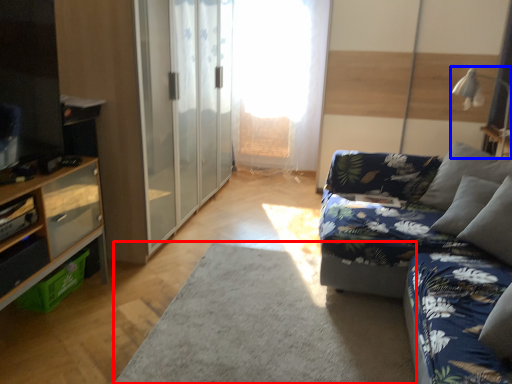
Question: Among these objects, which one is farthest to the camera, plain (highlighted by a red box) or lamp (highlighted by a blue box)?

Choices:
 (A) plain
 (B) lamp

Answer: (B)